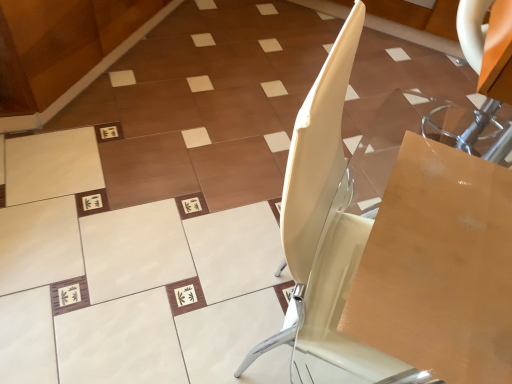
Question: Is wooden cardboard box at center-right further to the viewer compared to white glossy chair at center?

Choices:
 (A) no
 (B) yes

Answer: (B)

Question: Are wooden cardboard box at center-right and white glossy chair at center making contact?

Choices:
 (A) yes
 (B) no

Answer: (B)

Question: Could you tell me if wooden cardboard box at center-right is turned towards white glossy chair at center?

Choices:
 (A) no
 (B) yes

Answer: (B)

Question: Considering the relative positions of wooden cardboard box at center-right and white glossy chair at center in the image provided, is wooden cardboard box at center-right to the right of white glossy chair at center from the viewer's perspective?

Choices:
 (A) yes
 (B) no

Answer: (A)

Question: From a real-world perspective, is wooden cardboard box at center-right on top of white glossy chair at center?

Choices:
 (A) yes
 (B) no

Answer: (A)

Question: Can you confirm if wooden cardboard box at center-right is wider than white glossy chair at center?

Choices:
 (A) no
 (B) yes

Answer: (A)

Question: Can you confirm if transparent acrylic table at upper right is bigger than white glossy chair at center?

Choices:
 (A) no
 (B) yes

Answer: (A)

Question: Is transparent acrylic table at upper right completely or partially outside of white glossy chair at center?

Choices:
 (A) yes
 (B) no

Answer: (A)

Question: Is transparent acrylic table at upper right not near white glossy chair at center?

Choices:
 (A) no
 (B) yes

Answer: (A)

Question: Can you confirm if transparent acrylic table at upper right is positioned to the left of white glossy chair at center?

Choices:
 (A) no
 (B) yes

Answer: (A)

Question: Is transparent acrylic table at upper right oriented away from white glossy chair at center?

Choices:
 (A) yes
 (B) no

Answer: (B)

Question: From a real-world perspective, is transparent acrylic table at upper right physically below white glossy chair at center?

Choices:
 (A) no
 (B) yes

Answer: (B)

Question: From the image's perspective, is white glossy chair at center above transparent acrylic table at upper right?

Choices:
 (A) no
 (B) yes

Answer: (A)